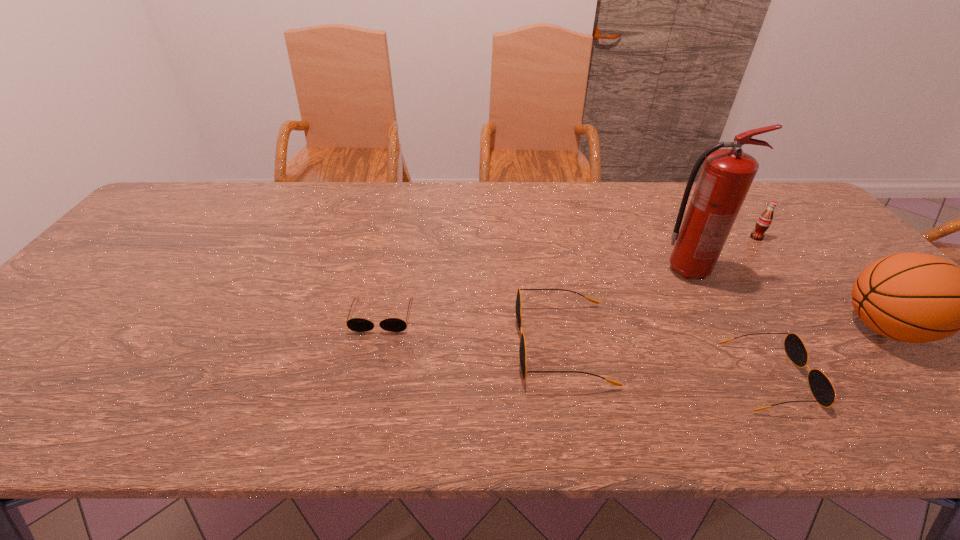
Locate an element on the screen. the shortest sunglasses is located at coordinates (354, 324).

You are a GUI agent. You are given a task and a screenshot of the screen. Output one action in this format:
    pyautogui.click(x=<x>, y=<y>)
    Task: Click on the shortest object
    The height and width of the screenshot is (540, 960).
    Given the screenshot: What is the action you would take?
    pyautogui.click(x=354, y=324)

The image size is (960, 540). I want to click on the tallest sunglasses, so click(x=522, y=348).

This screenshot has width=960, height=540. Find the location of `the third shortest object`. the third shortest object is located at coordinates (522, 348).

Where is `the rightmost sunglasses`? This screenshot has width=960, height=540. the rightmost sunglasses is located at coordinates (821, 387).

Image resolution: width=960 pixels, height=540 pixels. I want to click on the second shortest object, so click(x=821, y=387).

Find the location of a particular element. the farthest object is located at coordinates (764, 221).

You are a GUI agent. You are given a task and a screenshot of the screen. Output one action in this format:
    pyautogui.click(x=<x>, y=<y>)
    Task: Click on the soda
    
    Given the screenshot: What is the action you would take?
    pyautogui.click(x=764, y=221)

Where is `the tallest object`? This screenshot has height=540, width=960. the tallest object is located at coordinates (727, 174).

Find the location of a particular element. This screenshot has height=540, width=960. the fifth nearest object is located at coordinates (727, 174).